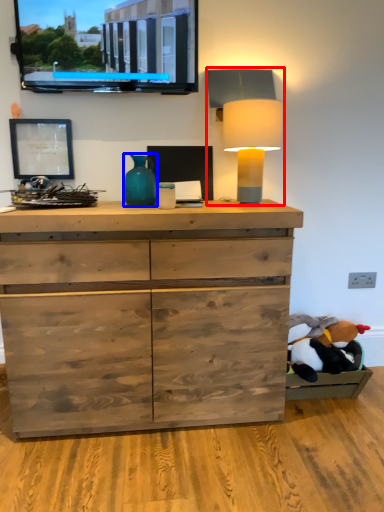
Question: Which point is further to the camera, table lamp (highlighted by a red box) or vase (highlighted by a blue box)?

Choices:
 (A) table lamp
 (B) vase

Answer: (B)